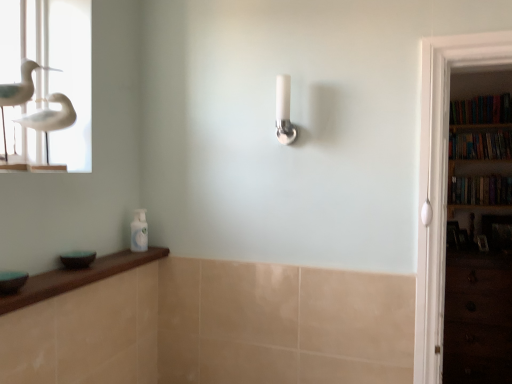
Question: Considering the relative positions of white glossy shower head at center and wooden bookshelf at right, marked as the 1th book in a bottom-to-top arrangement, in the image provided, is white glossy shower head at center behind wooden bookshelf at right, marked as the 1th book in a bottom-to-top arrangement,?

Choices:
 (A) no
 (B) yes

Answer: (A)

Question: Is the surface of white glossy shower head at center in direct contact with wooden bookshelf at right, marked as the 1th book in a bottom-to-top arrangement?

Choices:
 (A) no
 (B) yes

Answer: (A)

Question: From a real-world perspective, is white glossy shower head at center located higher than wooden bookshelf at right, marked as the 1th book in a bottom-to-top arrangement?

Choices:
 (A) yes
 (B) no

Answer: (A)

Question: From the image's perspective, is white glossy shower head at center below wooden bookshelf at right, which is the 3th book from top to bottom?

Choices:
 (A) no
 (B) yes

Answer: (A)

Question: Does white glossy shower head at center have a greater width compared to wooden bookshelf at right, marked as the 1th book in a bottom-to-top arrangement?

Choices:
 (A) no
 (B) yes

Answer: (A)

Question: Is white glossy shower head at center far away from wooden bookshelf at right, marked as the 1th book in a bottom-to-top arrangement?

Choices:
 (A) yes
 (B) no

Answer: (A)

Question: Can you confirm if white glossy shower head at center is positioned to the right of white matte bird at upper left?

Choices:
 (A) no
 (B) yes

Answer: (B)

Question: Can you confirm if white glossy shower head at center is thinner than white matte bird at upper left?

Choices:
 (A) no
 (B) yes

Answer: (B)

Question: From the image's perspective, is white glossy shower head at center located beneath white matte bird at upper left?

Choices:
 (A) no
 (B) yes

Answer: (A)

Question: Does white glossy shower head at center come behind white matte bird at upper left?

Choices:
 (A) yes
 (B) no

Answer: (A)

Question: Is white glossy shower head at center not inside white matte bird at upper left?

Choices:
 (A) no
 (B) yes

Answer: (B)

Question: Would you say white glossy shower head at center contains white matte bird at upper left?

Choices:
 (A) no
 (B) yes

Answer: (A)

Question: Is hardcover books at right, the 3th book ordered from the bottom, at the back of hardcover books at right, the second book from the top?

Choices:
 (A) yes
 (B) no

Answer: (B)